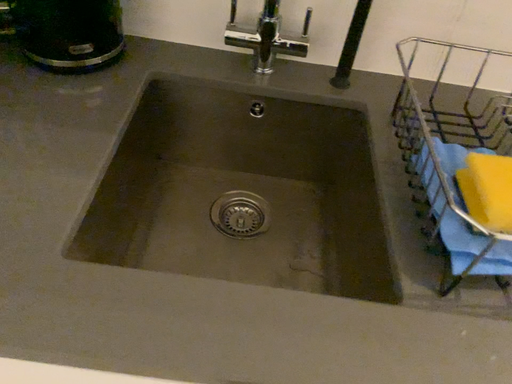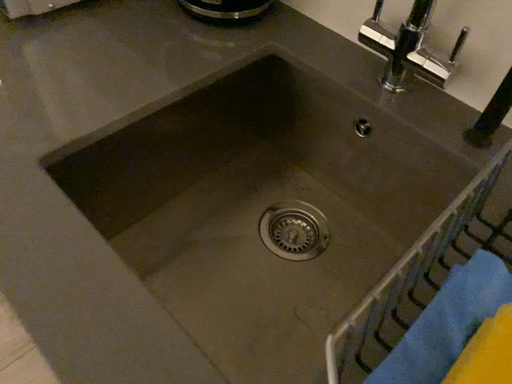
Question: How did the camera likely rotate when shooting the video?

Choices:
 (A) rotated left
 (B) rotated right

Answer: (A)